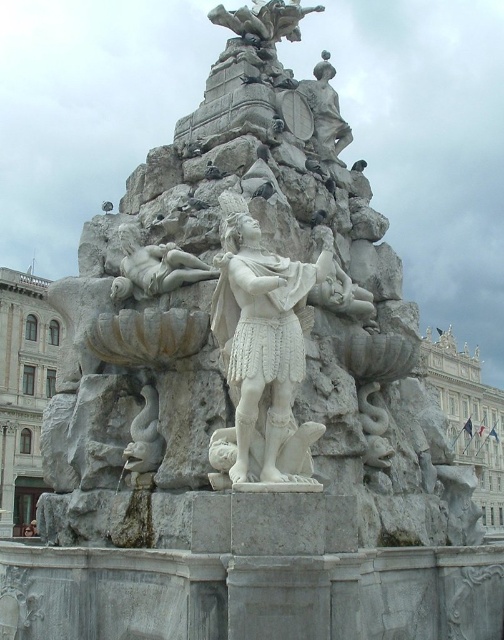
Can you confirm if white marble statue at center is positioned to the left of white marble statue at upper center?

Indeed, white marble statue at center is positioned on the left side of white marble statue at upper center.

Can you confirm if white marble statue at center is positioned to the right of white marble statue at upper center?

Incorrect, white marble statue at center is not on the right side of white marble statue at upper center.

This screenshot has width=504, height=640. Describe the element at coordinates (263, 353) in the screenshot. I see `white marble statue at center` at that location.

Where is `white marble statue at center`? white marble statue at center is located at coordinates (263, 353).

From the picture: Can you confirm if white marble statue at center is positioned above white marble reclining figure at center?

Incorrect, white marble statue at center is not positioned above white marble reclining figure at center.

Does point (217, 480) come behind point (155, 259)?

No, (217, 480) is in front of (155, 259).

Which is behind, point (226, 458) or point (129, 262)?

The point (129, 262) is behind.

Where is `white marble statue at center`? white marble statue at center is located at coordinates (263, 353).

Is white marble reclining figure at center closer to camera compared to white marble statue at upper center?

Yes, white marble reclining figure at center is closer to the viewer.

Does white marble reclining figure at center have a greater height compared to white marble statue at upper center?

No, white marble reclining figure at center is not taller than white marble statue at upper center.

Is point (172, 285) positioned after point (320, 116)?

That is False.

This screenshot has height=640, width=504. Identify the location of white marble reclining figure at center. (156, 269).